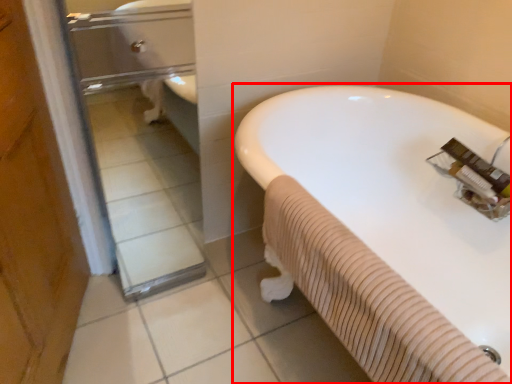
Question: From the image's perspective, what is the correct spatial positioning of bathtub (annotated by the red box) in reference to glass door?

Choices:
 (A) above
 (B) below

Answer: (B)